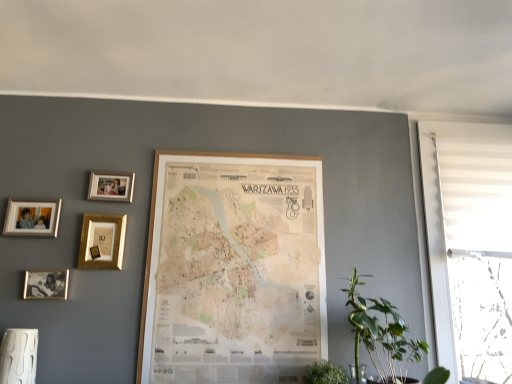
Find the location of a particular element. This screenshot has height=384, width=512. green leafy plant at lower right is located at coordinates (358, 315).

This screenshot has width=512, height=384. Identify the location of silver metallic photo frame at upper left, arranged as the 1th picture frame when viewed from the left. (32, 218).

The width and height of the screenshot is (512, 384). I want to click on gold metallic photo frame at upper left, the second picture frame in the right-to-left sequence, so click(x=111, y=186).

In order to face gold metallic picture frame at upper left, arranged as the 3th picture frame when viewed from the right, should I rotate leftwards or rightwards?

It's best to rotate left around 19.868 degrees.

This screenshot has width=512, height=384. I want to click on gold metallic picture frame at upper left, placed as the third picture frame when sorted from left to right, so click(102, 241).

The image size is (512, 384). Describe the element at coordinates (470, 246) in the screenshot. I see `white fabric window at right` at that location.

The width and height of the screenshot is (512, 384). Describe the element at coordinates (324, 373) in the screenshot. I see `green leafy plant at lower center, the first houseplant positioned from the left` at that location.

What are the coordinates of `green leafy plant at lower right` in the screenshot? It's located at (358, 315).

Is gold metallic photo frame at upper left, the 4th picture frame positioned from the left, placed right next to green leafy plant at lower right, arranged as the first houseplant when viewed from the right?

No.

Considering the sizes of objects gold metallic photo frame at upper left, the second picture frame in the right-to-left sequence, and green leafy plant at lower right, the 2th houseplant positioned from the left, in the image provided, who is bigger, gold metallic photo frame at upper left, the second picture frame in the right-to-left sequence, or green leafy plant at lower right, the 2th houseplant positioned from the left,?

Bigger between the two is green leafy plant at lower right, the 2th houseplant positioned from the left.

From the image's perspective, between gold metallic photo frame at upper left, the second picture frame in the right-to-left sequence, and green leafy plant at lower right, arranged as the first houseplant when viewed from the right, who is located below?

green leafy plant at lower right, arranged as the first houseplant when viewed from the right, from the image's perspective.

Which object is wider, gold metallic photo frame at upper left, the 4th picture frame positioned from the left, or green leafy plant at lower right, the 2th houseplant positioned from the left?

green leafy plant at lower right, the 2th houseplant positioned from the left, is wider.

Does point (56, 222) appear closer or farther from the camera than point (332, 370)?

Point (56, 222) is farther from the camera than point (332, 370).

Is silver metallic photo frame at upper left, arranged as the 1th picture frame when viewed from the left, touching green leafy plant at lower center, which is the 2th houseplant from right to left?

silver metallic photo frame at upper left, arranged as the 1th picture frame when viewed from the left, and green leafy plant at lower center, which is the 2th houseplant from right to left, are not in contact.

Does silver metallic photo frame at upper left, arranged as the 1th picture frame when viewed from the left, contain green leafy plant at lower center, which is the 2th houseplant from right to left?

That's incorrect, green leafy plant at lower center, which is the 2th houseplant from right to left, is not inside silver metallic photo frame at upper left, arranged as the 1th picture frame when viewed from the left.

Is green leafy plant at lower right at the left side of gold metallic photo frame at upper left, the second picture frame in the right-to-left sequence?

No, green leafy plant at lower right is not to the left of gold metallic photo frame at upper left, the second picture frame in the right-to-left sequence.

Is point (359, 330) positioned after point (122, 194)?

That is False.

Locate an element on the screen. plant in front of the gold metallic photo frame at upper left, the second picture frame in the right-to-left sequence is located at coordinates (358, 315).

Is green leafy plant at lower right positioned with its back to gold metallic photo frame at upper left, the 4th picture frame positioned from the left?

That's not correct — green leafy plant at lower right is not looking away from gold metallic photo frame at upper left, the 4th picture frame positioned from the left.

Considering the sizes of gold metallic photo frame at upper left, the second picture frame in the right-to-left sequence, and green leafy plant at lower center, which is the 2th houseplant from right to left, in the image, is gold metallic photo frame at upper left, the second picture frame in the right-to-left sequence, bigger or smaller than green leafy plant at lower center, which is the 2th houseplant from right to left,?

Clearly, gold metallic photo frame at upper left, the second picture frame in the right-to-left sequence, is smaller in size than green leafy plant at lower center, which is the 2th houseplant from right to left.

From a real-world perspective, which is physically below, gold metallic photo frame at upper left, the 4th picture frame positioned from the left, or green leafy plant at lower center, which is the 2th houseplant from right to left?

green leafy plant at lower center, which is the 2th houseplant from right to left, from a real-world perspective.

From the image's perspective, which one is positioned higher, gold metallic photo frame at upper left, the second picture frame in the right-to-left sequence, or green leafy plant at lower center, the first houseplant positioned from the left?

gold metallic photo frame at upper left, the second picture frame in the right-to-left sequence, from the image's perspective.

Which of these two, gold metallic photo frame at upper left, the 4th picture frame positioned from the left, or green leafy plant at lower center, the first houseplant positioned from the left, stands taller?

green leafy plant at lower center, the first houseplant positioned from the left.

From the picture: Which of these two, matte gold photo frame at lower left, acting as the 4th picture frame starting from the right, or gold metallic photo frame at upper left, the 4th picture frame positioned from the left, is smaller?

Smaller between the two is matte gold photo frame at lower left, acting as the 4th picture frame starting from the right.

Is matte gold photo frame at lower left, placed as the 2th picture frame when sorted from left to right, facing away from gold metallic photo frame at upper left, the second picture frame in the right-to-left sequence?

matte gold photo frame at lower left, placed as the 2th picture frame when sorted from left to right, does not have its back to gold metallic photo frame at upper left, the second picture frame in the right-to-left sequence.

Is the position of matte gold photo frame at lower left, acting as the 4th picture frame starting from the right, more distant than that of gold metallic photo frame at upper left, the 4th picture frame positioned from the left?

No.

In the scene shown: Does matte gold photo frame at lower left, placed as the 2th picture frame when sorted from left to right, have a larger size compared to wooden map at center, which is the fifth picture frame from left to right?

Actually, matte gold photo frame at lower left, placed as the 2th picture frame when sorted from left to right, might be smaller than wooden map at center, which is the fifth picture frame from left to right.

Considering the points (51, 290) and (274, 277), which point is in front, point (51, 290) or point (274, 277)?

The point (51, 290) is more forward.

Is matte gold photo frame at lower left, placed as the 2th picture frame when sorted from left to right, completely or partially outside of wooden map at center, which is the 1th picture frame from right to left?

Yes, matte gold photo frame at lower left, placed as the 2th picture frame when sorted from left to right, is outside of wooden map at center, which is the 1th picture frame from right to left.

Which object is positioned more to the left, white fabric window at right or green leafy plant at lower right?

green leafy plant at lower right is more to the left.

Which object is closer to the camera taking this photo, white fabric window at right or green leafy plant at lower right?

green leafy plant at lower right.

Looking at their sizes, would you say white fabric window at right is wider or thinner than green leafy plant at lower right?

Clearly, white fabric window at right has less width compared to green leafy plant at lower right.

At what (x,y) coordinates should I click in order to perform the action: click on window above the green leafy plant at lower right (from the image's perspective). Please return your answer as a coordinate pair (x, y). This screenshot has width=512, height=384. Looking at the image, I should click on (470, 246).

Which picture frame is the 5th one when counting from the back of the green leafy plant at lower right, the 2th houseplant positioned from the left? Please provide its 2D coordinates.

[(111, 186)]

You are a GUI agent. You are given a task and a screenshot of the screen. Output one action in this format:
    pyautogui.click(x=<x>, y=<y>)
    Task: Click on the 5th picture frame to the left of the green leafy plant at lower center, the first houseplant positioned from the left, counting from the anchor's position
    Image resolution: width=512 pixels, height=384 pixels.
    Given the screenshot: What is the action you would take?
    pyautogui.click(x=32, y=218)

Based on their spatial positions, is green leafy plant at lower center, which is the 2th houseplant from right to left, or green leafy plant at lower right, arranged as the first houseplant when viewed from the right, further from green leafy plant at lower right?

Based on the image, green leafy plant at lower center, which is the 2th houseplant from right to left, appears to be further to green leafy plant at lower right.

Estimate the real-world distances between objects in this image. Which object is further from gold metallic photo frame at upper left, the 4th picture frame positioned from the left, wooden map at center, which is the 1th picture frame from right to left, or green leafy plant at lower center, which is the 2th houseplant from right to left?

Based on the image, green leafy plant at lower center, which is the 2th houseplant from right to left, appears to be further to gold metallic photo frame at upper left, the 4th picture frame positioned from the left.

Considering their positions, is gold metallic photo frame at upper left, the second picture frame in the right-to-left sequence, positioned closer to green leafy plant at lower center, the first houseplant positioned from the left, than green leafy plant at lower right?

green leafy plant at lower right.

Based on their spatial positions, is silver metallic photo frame at upper left, arranged as the 1th picture frame when viewed from the left, or wooden map at center, which is the fifth picture frame from left to right, closer to green leafy plant at lower center, which is the 2th houseplant from right to left?

Based on the image, wooden map at center, which is the fifth picture frame from left to right, appears to be nearer to green leafy plant at lower center, which is the 2th houseplant from right to left.

Based on their spatial positions, is wooden map at center, which is the 1th picture frame from right to left, or green leafy plant at lower right, the 2th houseplant positioned from the left, further from silver metallic photo frame at upper left, arranged as the 1th picture frame when viewed from the left?

green leafy plant at lower right, the 2th houseplant positioned from the left, is positioned further to the anchor silver metallic photo frame at upper left, arranged as the 1th picture frame when viewed from the left.

From the picture: From the image, which object appears to be farther from green leafy plant at lower center, the first houseplant positioned from the left, green leafy plant at lower right, arranged as the first houseplant when viewed from the right, or white fabric window at right?

The object further to green leafy plant at lower center, the first houseplant positioned from the left, is white fabric window at right.

Considering their positions, is gold metallic picture frame at upper left, placed as the third picture frame when sorted from left to right, positioned further to green leafy plant at lower right, the 2th houseplant positioned from the left, than green leafy plant at lower center, which is the 2th houseplant from right to left?

Among the two, gold metallic picture frame at upper left, placed as the third picture frame when sorted from left to right, is located further to green leafy plant at lower right, the 2th houseplant positioned from the left.

Which object lies further to the anchor point matte gold photo frame at lower left, placed as the 2th picture frame when sorted from left to right, green leafy plant at lower right or green leafy plant at lower center, the first houseplant positioned from the left?

green leafy plant at lower right is positioned further to the anchor matte gold photo frame at lower left, placed as the 2th picture frame when sorted from left to right.

At what (x,y) coordinates should I click in order to perform the action: click on houseplant between wooden map at center, which is the fifth picture frame from left to right, and green leafy plant at lower right, the 2th houseplant positioned from the left, from left to right. Please return your answer as a coordinate pair (x, y). The width and height of the screenshot is (512, 384). Looking at the image, I should click on (324, 373).

Image resolution: width=512 pixels, height=384 pixels. I want to click on plant between matte gold photo frame at lower left, placed as the 2th picture frame when sorted from left to right, and white fabric window at right, so click(358, 315).

Identify the location of picture frame between gold metallic picture frame at upper left, arranged as the 3th picture frame when viewed from the right, and wooden map at center, which is the 1th picture frame from right to left, in the horizontal direction. (111, 186).

Locate an element on the screen. This screenshot has height=384, width=512. plant situated between matte gold photo frame at lower left, placed as the 2th picture frame when sorted from left to right, and green leafy plant at lower right, the 2th houseplant positioned from the left, from left to right is located at coordinates (358, 315).